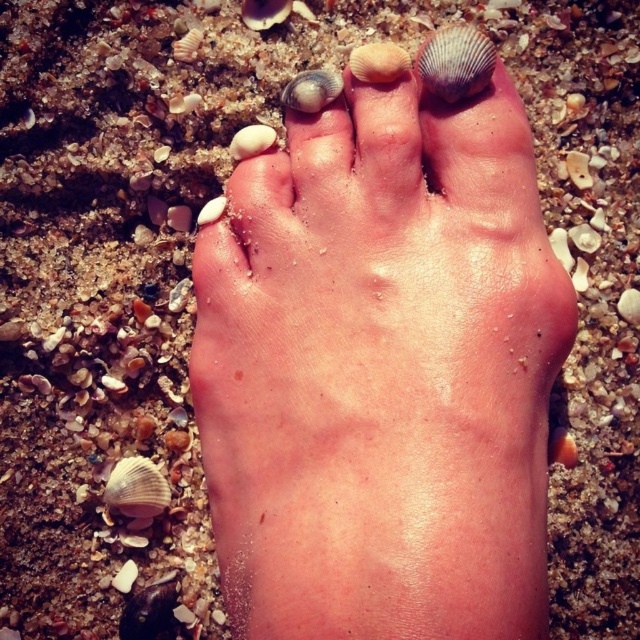
Question: Considering the real-world distances, which object is farthest from the matte seashell at upper center?

Choices:
 (A) dry skin foot at center
 (B) shiny metallic seashell at center

Answer: (A)

Question: Does shiny brown seashell at upper right have a greater width compared to matte seashell at upper center?

Choices:
 (A) no
 (B) yes

Answer: (B)

Question: Which point appears closest to the camera in this image?

Choices:
 (A) (317, 68)
 (B) (362, 54)

Answer: (B)

Question: Is shiny brown seashell at upper right smaller than shiny metallic seashell at center?

Choices:
 (A) yes
 (B) no

Answer: (B)

Question: Can you confirm if shiny brown seashell at upper right is bigger than matte seashell at upper center?

Choices:
 (A) yes
 (B) no

Answer: (A)

Question: Considering the real-world distances, which object is closest to the dry skin foot at center?

Choices:
 (A) shiny brown seashell at upper right
 (B) matte seashell at upper center
 (C) shiny metallic seashell at center

Answer: (A)